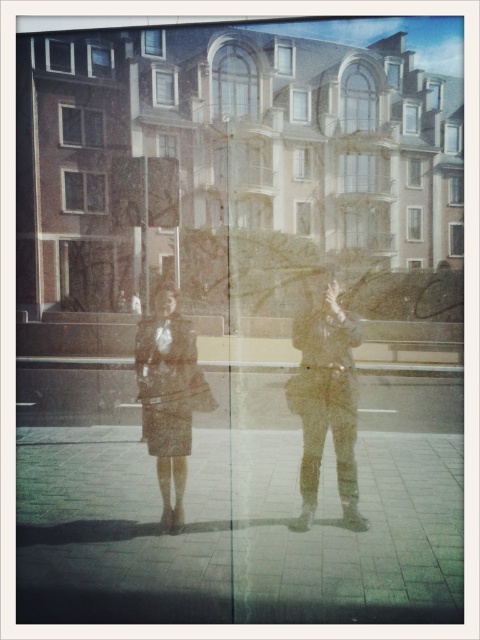
Does matte black coat at center have a greater width compared to matte black jacket at center?

In fact, matte black coat at center might be narrower than matte black jacket at center.

How distant is matte black coat at center from matte black jacket at center?

matte black coat at center is 0.39 inches away from matte black jacket at center.

Which is in front, point (323, 410) or point (337, 316)?

Point (337, 316) is in front.

Where is `matte black coat at center`? The image size is (480, 640). matte black coat at center is located at coordinates (326, 403).

Is matte black coat at center shorter than matte brown coat at center?

No, matte black coat at center is not shorter than matte brown coat at center.

Between matte black coat at center and matte brown coat at center, which one has more height?

With more height is matte black coat at center.

Find the location of a particular element. The width and height of the screenshot is (480, 640). matte black coat at center is located at coordinates (326, 403).

Which is behind, point (417, 486) or point (177, 413)?

The point (177, 413) is more distant.

Can you confirm if smooth concrete pavement at lower center is positioned below matte brown coat at center?

Yes.

Describe the element at coordinates (238, 532) in the screenshot. I see `smooth concrete pavement at lower center` at that location.

Where is `smooth concrete pavement at lower center`? The image size is (480, 640). smooth concrete pavement at lower center is located at coordinates (238, 532).